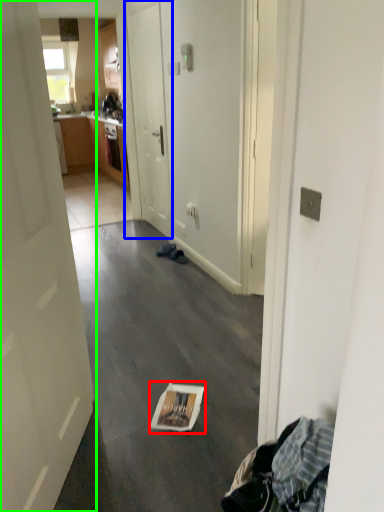
Question: Based on their relative distances, which object is nearer to magazine (highlighted by a red box)? Choose from door (highlighted by a blue box) and door (highlighted by a green box).

Choices:
 (A) door
 (B) door

Answer: (B)